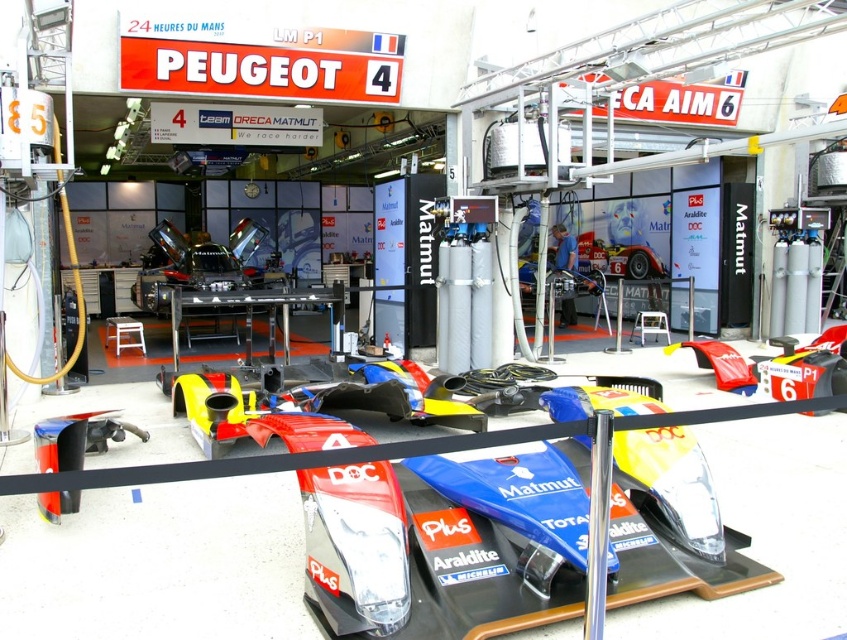
Which of these two, silver metallic race car at center or metallic silver mechanic at center, stands shorter?

metallic silver mechanic at center

Who is positioned more to the left, silver metallic race car at center or metallic silver mechanic at center?

Positioned to the left is silver metallic race car at center.

This screenshot has height=640, width=847. I want to click on silver metallic race car at center, so pos(195,264).

Between point (333, 538) and point (569, 266), which one is positioned in front?

Point (333, 538) is more forward.

Describe the element at coordinates (436, 548) in the screenshot. This screenshot has height=640, width=847. I see `shiny blue carbon fiber race car at center` at that location.

Locate an element on the screen. This screenshot has width=847, height=640. shiny blue carbon fiber race car at center is located at coordinates (436, 548).

Which is in front, point (360, 627) or point (174, 284)?

Positioned in front is point (360, 627).

Is shiny blue carbon fiber race car at center bigger than silver metallic race car at center?

No.

Find the location of a particular element. shiny blue carbon fiber race car at center is located at coordinates (436, 548).